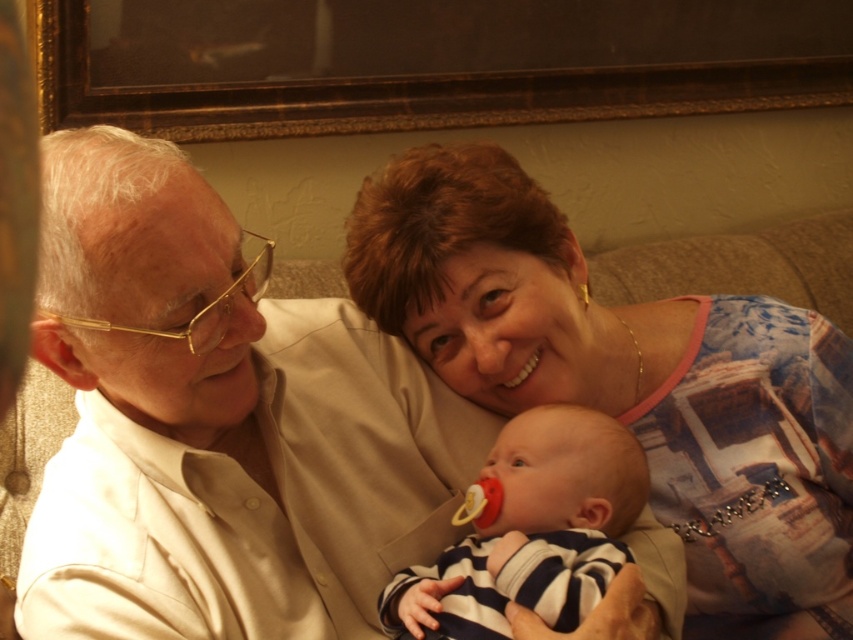
You are standing in the living room and want to move from point A to point B. Point A is at coordinates point (792, 582) and point B is at coordinates point (285, 60). Which direction should you move to go from point A to point B?

To move from point A to point B, you should move towards the lower left direction since point A is in front of point B.

You are a photographer trying to capture a candid shot of the striped fabric baby at center and the dark brown wooden picture frame at upper center. Since you want both subjects in the same frame, which direction should you adjust your camera to ensure both are visible?

The dark brown wooden picture frame at upper center is to the right of the striped fabric baby at center, so you should adjust your camera slightly to the right to include both subjects in the frame.

You are standing in the living room and want to hang a small decoration on the wall. The dark brown wooden picture frame at upper center is already there. Where would you place the decoration if you want it to be exactly at the coordinates point (431, 61)?

The coordinates point (431, 61) are on the dark brown wooden picture frame at upper center, so placing the decoration there would mean it is attached to the frame itself. However, since the frame is already present, you might need to choose a different location on the wall to avoid overlapping.